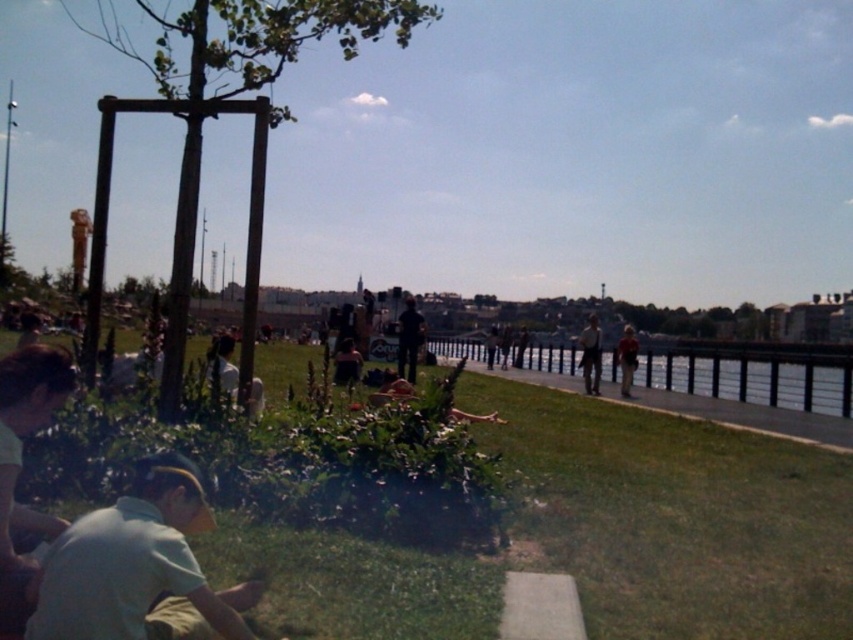
Does point (654, 355) come closer to viewer compared to point (409, 348)?

No.

The height and width of the screenshot is (640, 853). I want to click on clear glass waterway at center, so click(x=751, y=380).

Is green grass at lower center to the left of clear glass waterway at center from the viewer's perspective?

Correct, you'll find green grass at lower center to the left of clear glass waterway at center.

Is green grass at lower center wider than clear glass waterway at center?

Yes.

Does point (381, 541) come closer to viewer compared to point (817, 381)?

That is True.

Identify the location of green grass at lower center. This screenshot has width=853, height=640. (573, 532).

Who is lower down, green grass at lower center or light brown leather jacket at center?

green grass at lower center is below.

Is point (430, 522) positioned behind point (584, 353)?

No, it is in front of (584, 353).

Who is more forward, (601, 412) or (590, 365)?

Point (601, 412)

Locate an element on the screen. This screenshot has height=640, width=853. green grass at lower center is located at coordinates (573, 532).